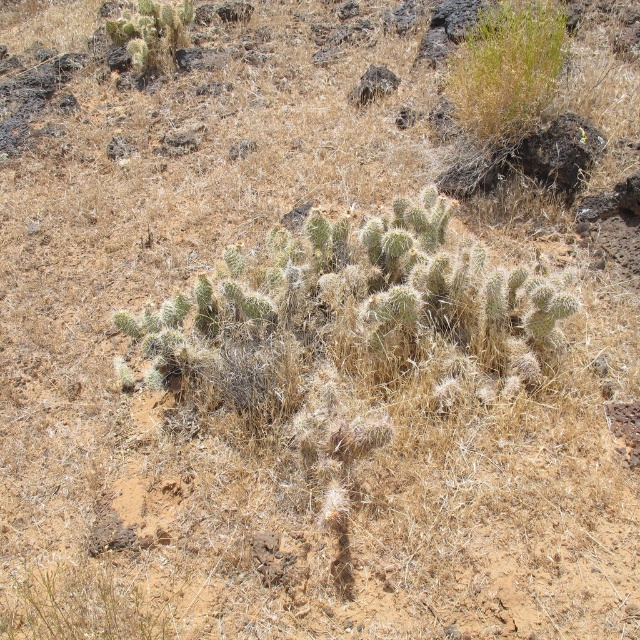
You are a desert explorer who needs to find shade. You see a green fuzzy bush at upper center and a green spiny cactus at upper left. Which one is more likely to provide shade?

The green spiny cactus at upper left is positioned above the green fuzzy bush at upper center, so it is more likely to provide shade.

You are an explorer in the desert who needs to collect samples. You have a 3 meter long tool to reach objects. Can you use your tool to collect samples from both the green fuzzy bush at upper center and the green spiny cactus at upper left without moving closer?

The distance between the green fuzzy bush at upper center and the green spiny cactus at upper left is 3.25 meters. Since your tool is only 3 meters long, you cannot reach both samples without moving closer.

You are a desert explorer who needs to identify the tallest plant between the green fuzzy bush at upper center and the green spiny cactus at upper left. Which one is taller?

The green fuzzy bush at upper center is taller than the green spiny cactus at upper left.